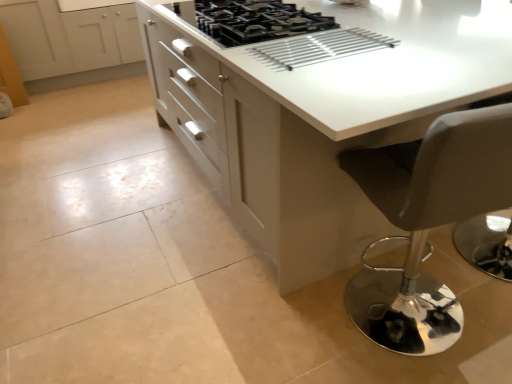
Question: Can you confirm if black matte gas stove at center is thinner than matte black stool at lower right?

Choices:
 (A) no
 (B) yes

Answer: (A)

Question: Is black matte gas stove at center positioned before matte black stool at lower right?

Choices:
 (A) no
 (B) yes

Answer: (A)

Question: From a real-world perspective, is black matte gas stove at center under matte black stool at lower right?

Choices:
 (A) yes
 (B) no

Answer: (B)

Question: From the image's perspective, would you say black matte gas stove at center is shown under matte black stool at lower right?

Choices:
 (A) no
 (B) yes

Answer: (A)

Question: Considering the relative sizes of black matte gas stove at center and matte black stool at lower right in the image provided, is black matte gas stove at center shorter than matte black stool at lower right?

Choices:
 (A) no
 (B) yes

Answer: (B)

Question: Is white glossy cabinet at upper left in front of or behind white glossy countertop at center in the image?

Choices:
 (A) behind
 (B) front

Answer: (A)

Question: From a real-world perspective, is white glossy cabinet at upper left above or below white glossy countertop at center?

Choices:
 (A) below
 (B) above

Answer: (A)

Question: Based on their sizes in the image, would you say white glossy cabinet at upper left is bigger or smaller than white glossy countertop at center?

Choices:
 (A) small
 (B) big

Answer: (A)

Question: Is white glossy cabinet at upper left taller or shorter than white glossy countertop at center?

Choices:
 (A) tall
 (B) short

Answer: (B)

Question: Is point (444, 201) closer or farther from the camera than point (300, 114)?

Choices:
 (A) farther
 (B) closer

Answer: (B)

Question: In terms of width, does matte black stool at lower right look wider or thinner when compared to white glossy countertop at center?

Choices:
 (A) thin
 (B) wide

Answer: (A)

Question: Based on their sizes in the image, would you say matte black stool at lower right is bigger or smaller than white glossy countertop at center?

Choices:
 (A) big
 (B) small

Answer: (B)

Question: In the image, is matte black stool at lower right positioned in front of or behind white glossy countertop at center?

Choices:
 (A) behind
 (B) front

Answer: (B)

Question: From their relative heights in the image, would you say white glossy cabinet at upper left is taller or shorter than matte black stool at lower right?

Choices:
 (A) short
 (B) tall

Answer: (A)

Question: Looking at their shapes, would you say white glossy cabinet at upper left is wider or thinner than matte black stool at lower right?

Choices:
 (A) wide
 (B) thin

Answer: (A)